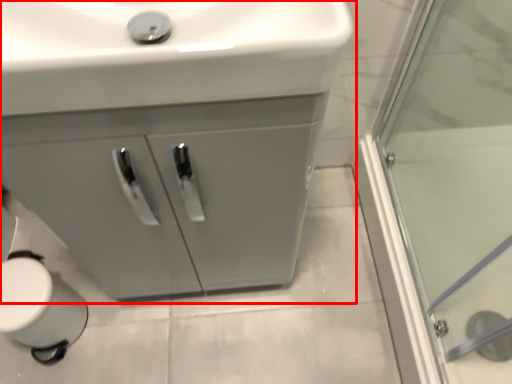
Question: From the image's perspective, considering the relative positions of bathroom cabinet (annotated by the red box) and sink in the image provided, where is bathroom cabinet (annotated by the red box) located with respect to the staircase?

Choices:
 (A) below
 (B) above

Answer: (A)